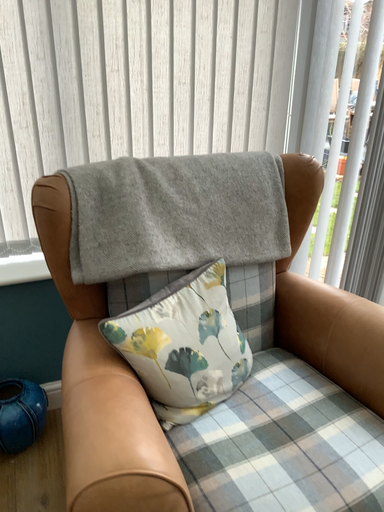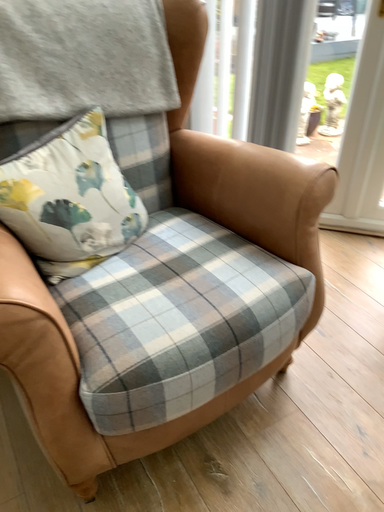
Question: How did the camera likely rotate when shooting the video?

Choices:
 (A) rotated right
 (B) rotated left

Answer: (A)